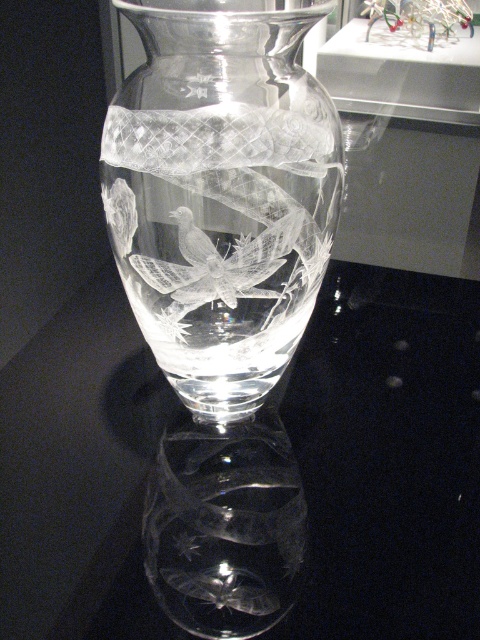
You are arranging flowers in a room and see both the transparent glass vase at center and the clear crystal vase at center. Which one is located to the right of the other?

The transparent glass vase at center is positioned on the right side of the clear crystal vase at center.

You are an interior designer arranging a table with two vases. You have a transparent glass vase at center and a clear crystal vase at center. Which vase would you choose if you want the one that takes up more space on the table?

The transparent glass vase at center has a larger size compared to the clear crystal vase at center, so it would take up more space on the table.

From the picture: You are an interior designer arranging a table. You have a transparent glass vase at center and a clear crystal vase at center. Which one is shorter?

The transparent glass vase at center is not as tall as the clear crystal vase at center, so the transparent glass vase at center is shorter.